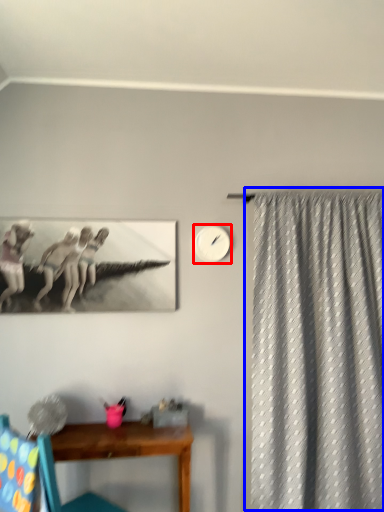
Question: Which object is closer to the camera taking this photo, clock (highlighted by a red box) or curtain (highlighted by a blue box)?

Choices:
 (A) clock
 (B) curtain

Answer: (B)